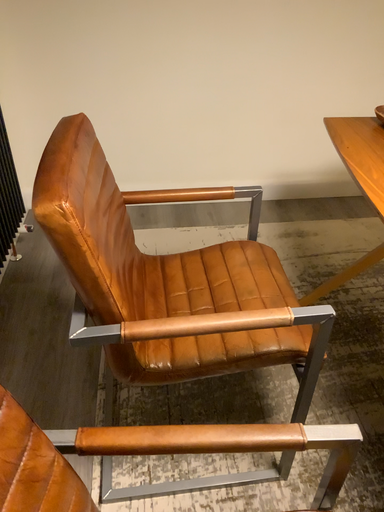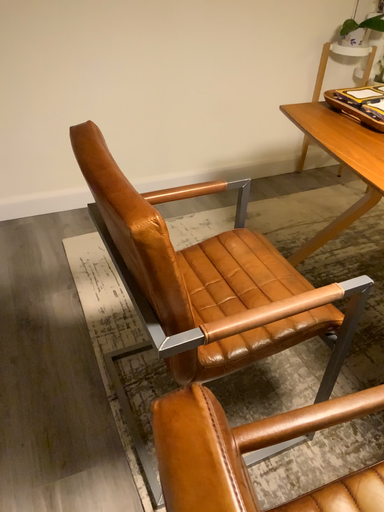
Question: How did the camera likely rotate when shooting the video?

Choices:
 (A) rotated left
 (B) rotated right

Answer: (B)